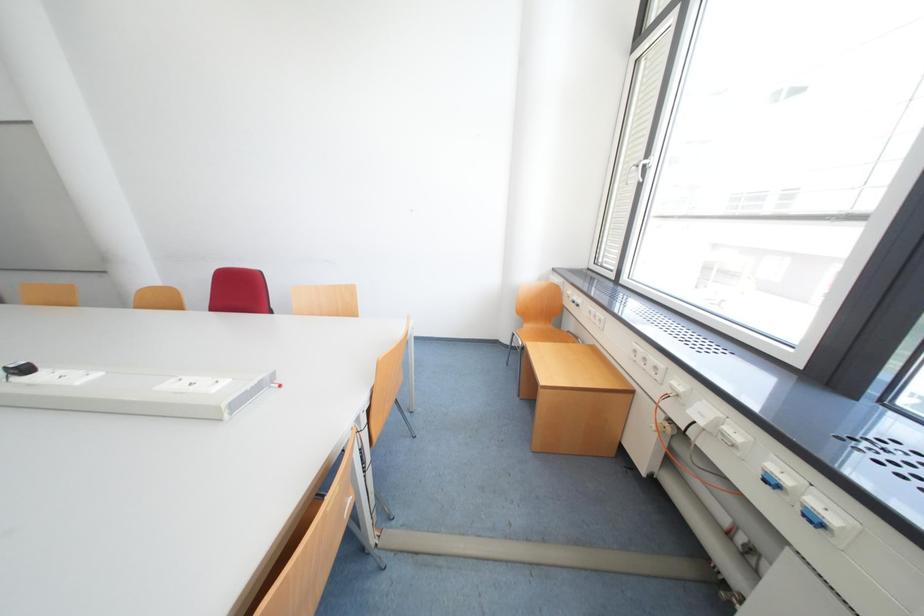
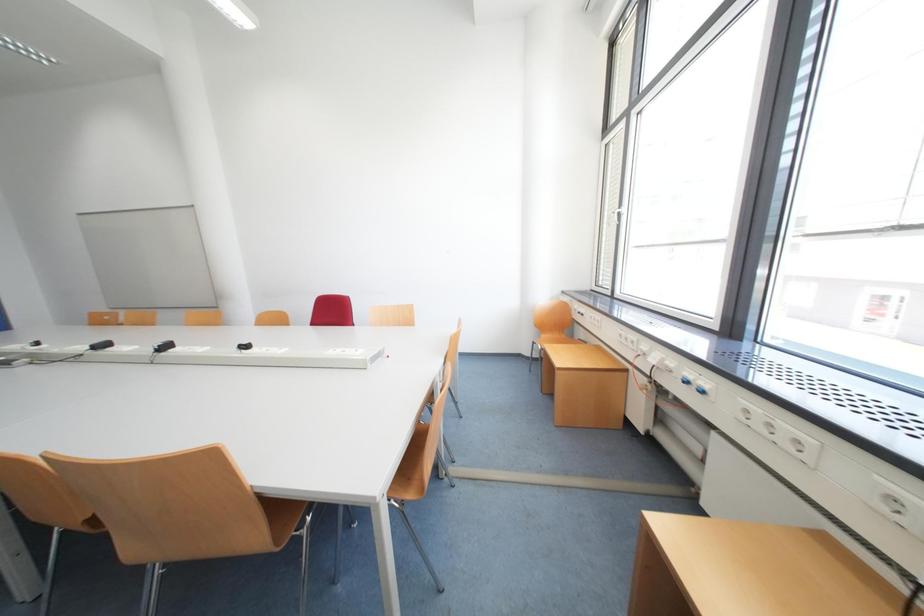
Question: The images are taken continuously from a first-person perspective. In which direction is your viewpoint rotating?

Choices:
 (A) Left
 (B) Right
 (C) Up
 (D) Down

Answer: (C)